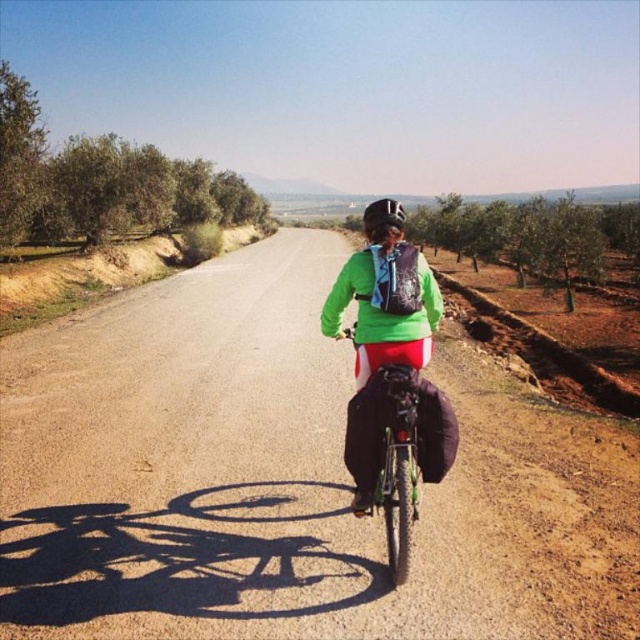
Question: Is brown gravel road at center to the left of green matte jacket at center from the viewer's perspective?

Choices:
 (A) yes
 (B) no

Answer: (A)

Question: Which of the following is the farthest from the observer?

Choices:
 (A) brown gravel road at center
 (B) green matte bicycle at center

Answer: (B)

Question: Is green matte jacket at center to the left of green matte bicycle at center from the viewer's perspective?

Choices:
 (A) yes
 (B) no

Answer: (A)

Question: Is brown gravel road at center below green matte jacket at center?

Choices:
 (A) yes
 (B) no

Answer: (A)

Question: Estimate the real-world distances between objects in this image. Which object is closer to the green matte jacket at center?

Choices:
 (A) brown gravel road at center
 (B) green matte bicycle at center

Answer: (B)

Question: Among these points, which one is nearest to the camera?

Choices:
 (A) (186, 477)
 (B) (358, 362)

Answer: (B)